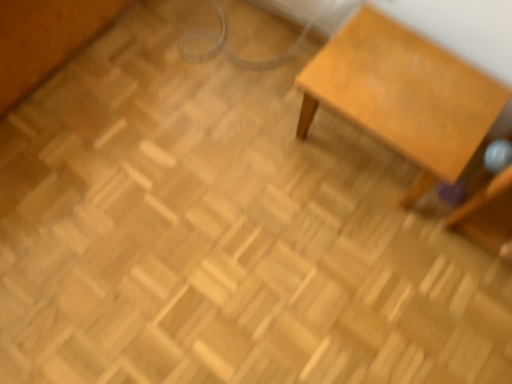
Image resolution: width=512 pixels, height=384 pixels. What are the coordinates of `free space above light brown wooden table at upper right (from a real-world perspective)` in the screenshot? It's located at (410, 84).